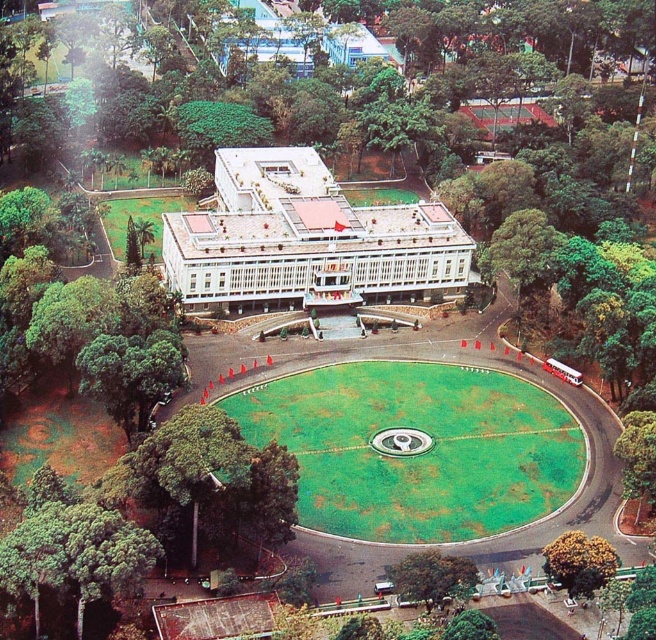
Is green grass at center bigger than green grass lawn at left?

Yes.

Which is more to the right, green grass at center or green grass lawn at left?

From the viewer's perspective, green grass at center appears more on the right side.

Who is more distant from viewer, [447,454] or [117,220]?

Positioned behind is point [117,220].

Image resolution: width=656 pixels, height=640 pixels. Identify the location of green grass at center. (415, 449).

Which is above, yellow-green leafy tree at lower right or green leafy tree at lower right?

green leafy tree at lower right

Who is shorter, yellow-green leafy tree at lower right or green leafy tree at lower right?

With less height is yellow-green leafy tree at lower right.

Is point (562, 554) more distant than point (630, 422)?

No, it is not.

The image size is (656, 640). I want to click on yellow-green leafy tree at lower right, so click(579, 563).

Is green leafy tree at lower right further to camera compared to green grass lawn at left?

No.

Between green leafy tree at lower right and green grass lawn at left, which one appears on the right side from the viewer's perspective?

green leafy tree at lower right is more to the right.

Based on the photo, who is more distant from viewer, (647, 481) or (142, 209)?

Point (142, 209)

Where is `green leafy tree at lower right`? green leafy tree at lower right is located at coordinates (638, 458).